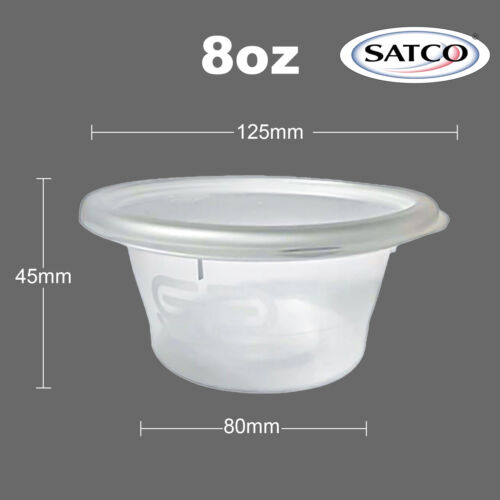
I want to click on height of tub, so click(28, 278).